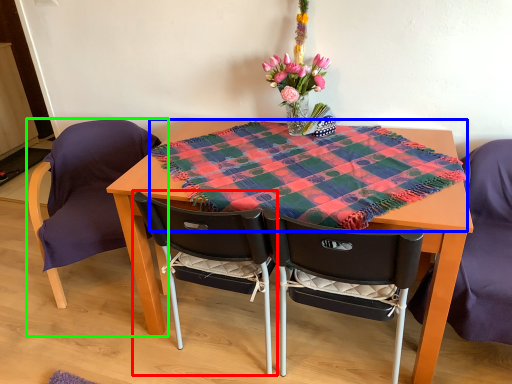
Question: Considering the real-world distances, which object is closest to chair (highlighted by a red box)? blanket (highlighted by a blue box) or chair (highlighted by a green box).

Choices:
 (A) blanket
 (B) chair

Answer: (A)